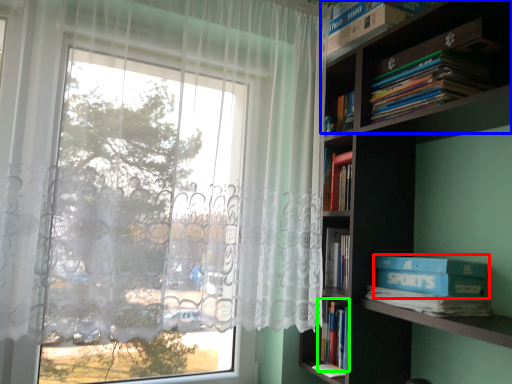
Question: Estimate the real-world distances between objects in this image. Which object is closer to paperback book (highlighted by a red box), shelf (highlighted by a blue box) or book (highlighted by a green box)?

Choices:
 (A) shelf
 (B) book

Answer: (B)